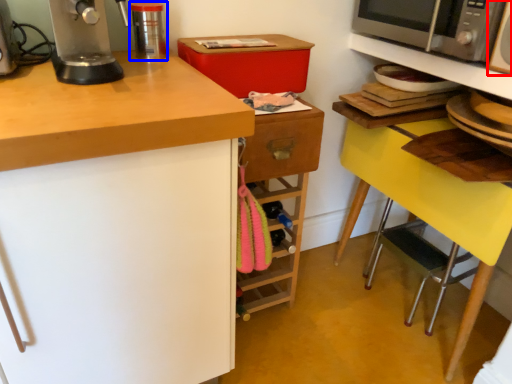
Question: Among these objects, which one is nearest to the camera, appliance (highlighted by a red box) or kitchen appliance (highlighted by a blue box)?

Choices:
 (A) appliance
 (B) kitchen appliance

Answer: (A)